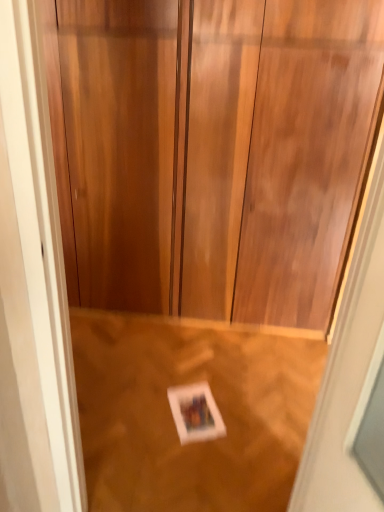
In order to click on vacant region to the left of white paper at center in this screenshot , I will do `click(143, 406)`.